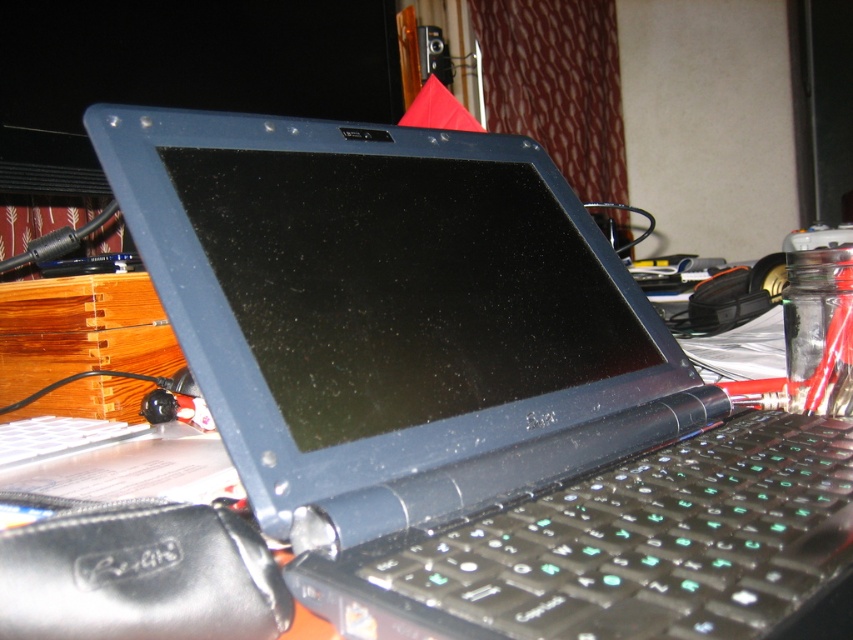
You are a delivery person who needs to place a small package on the desk without blocking the Dell laptop. The desk has a black leather pouch at lower left. Where should you place the package to avoid covering the Dell laptop?

Place the package near the black leather pouch at lower left, since the pouch is located at the lower left corner of the desk, which is away from the Dell laptop.

You are organizing the desk and want to place the black leather pouch at lower left in front of the black plastic keyboard at center. Can you do that without moving the keyboard?

The black leather pouch at lower left is currently behind the black plastic keyboard at center. To place it in front, you would need to move the keyboard out of the way first.

You are a delivery person who needs to place a small package on the desk without blocking the Dell laptop. The package is 8 inches long. Is there enough space between the black leather pouch at lower left and the edge of the desk to place the package?

The black leather pouch at lower left is 8.60 inches from the camera. Since the package is 8 inches long, there is enough space between the black leather pouch at lower left and the edge of the desk to place the package.